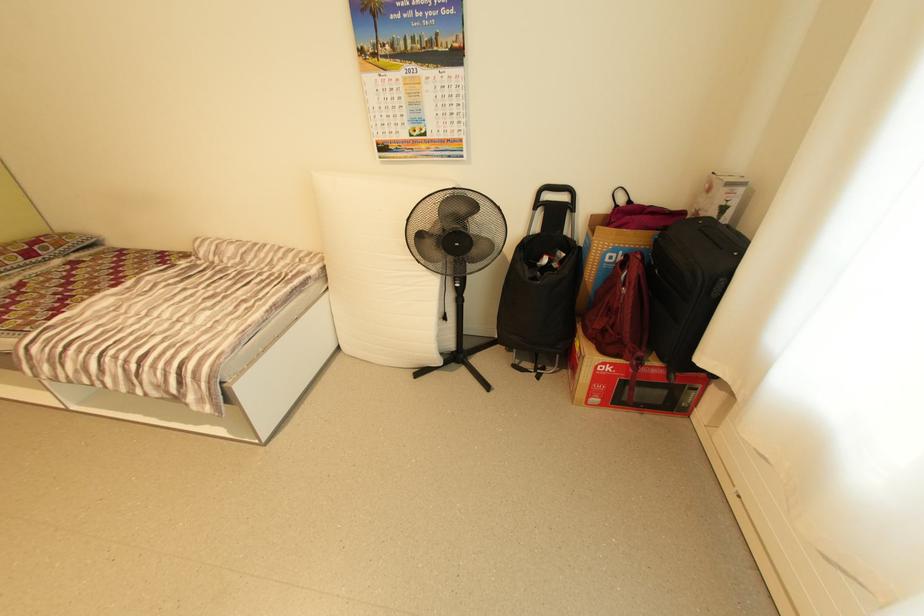
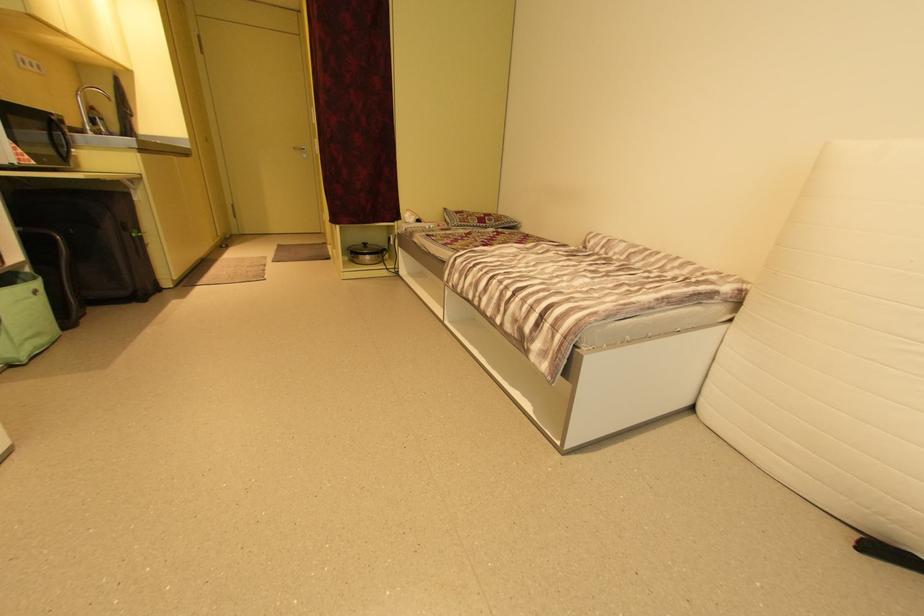
Question: The first image is from the beginning of the video and the second image is from the end. How did the camera likely rotate when shooting the video?

Choices:
 (A) Left
 (B) Right
 (C) Up
 (D) Down

Answer: (A)